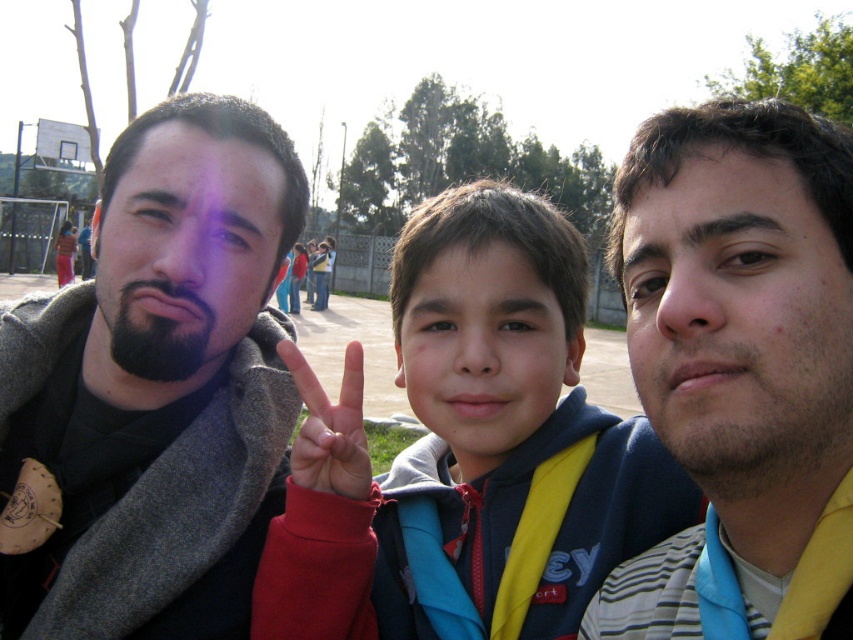
Measure the distance from blue fleece jacket at center to smooth skin face at center.

26.47 centimeters

Which of these two, blue fleece jacket at center or smooth skin face at center, stands shorter?

blue fleece jacket at center is shorter.

Describe the element at coordinates (468, 451) in the screenshot. I see `blue fleece jacket at center` at that location.

The height and width of the screenshot is (640, 853). Identify the location of blue fleece jacket at center. (468, 451).

Between gray wool scarf at left and smooth skin face at right, which one is positioned lower?

gray wool scarf at left

Can you confirm if gray wool scarf at left is thinner than smooth skin face at right?

No.

At what (x,y) coordinates should I click in order to perform the action: click on gray wool scarf at left. Please return your answer as a coordinate pair (x, y). The width and height of the screenshot is (853, 640). Looking at the image, I should click on (154, 388).

Does point (743, 209) come in front of point (189, 364)?

Yes, it is in front of point (189, 364).

Which is in front, point (747, 198) or point (111, 264)?

Point (747, 198)

Which is behind, point (761, 358) or point (221, 173)?

The point (221, 173) is more distant.

You are a GUI agent. You are given a task and a screenshot of the screen. Output one action in this format:
    pyautogui.click(x=<x>, y=<y>)
    Task: Click on the smooth skin face at right
    
    Given the screenshot: What is the action you would take?
    pyautogui.click(x=740, y=320)